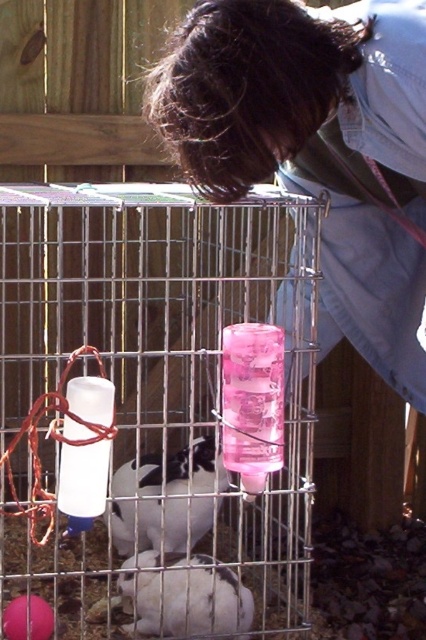
Question: Is the position of pink plastic water bottle at center more distant than that of white fur rabbit at lower center?

Choices:
 (A) yes
 (B) no

Answer: (B)

Question: Which object is farther from the camera taking this photo?

Choices:
 (A) white fur rabbit at lower center
 (B) pink plastic water bottle at center

Answer: (A)

Question: Which of these objects is positioned farthest from the white fur rabbit at lower center?

Choices:
 (A) white matte rabbit at center
 (B) pink plastic water bottle at center

Answer: (B)

Question: Is pink plastic water bottle at center closer to camera compared to white matte rabbit at center?

Choices:
 (A) no
 (B) yes

Answer: (B)

Question: From the image, what is the correct spatial relationship of pink plastic water bottle at center in relation to white fur rabbit at lower center?

Choices:
 (A) right
 (B) left

Answer: (B)

Question: Which point appears farthest from the camera in this image?

Choices:
 (A) (158, 497)
 (B) (166, 208)

Answer: (B)